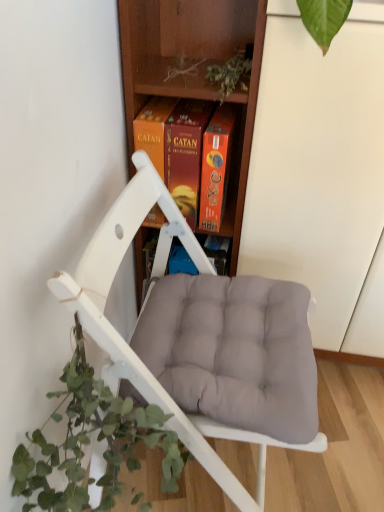
What do you see at coordinates (125, 341) in the screenshot? This screenshot has height=512, width=384. I see `white matte chair at center` at bounding box center [125, 341].

What is the approximate height of white matte chair at center?

It is 31.40 inches.

Locate an element on the screen. orange cardboard game box at center is located at coordinates (176, 146).

Image resolution: width=384 pixels, height=512 pixels. In the image, there is a orange cardboard game box at center. What are the coordinates of `chair below it (from a real-world perspective)` in the screenshot? It's located at click(x=125, y=341).

Does orange cardboard game box at center have a greater height compared to white matte chair at center?

Incorrect, the height of orange cardboard game box at center is not larger of that of white matte chair at center.

From the image's perspective, between orange cardboard game box at center and white matte chair at center, which one is located above?

orange cardboard game box at center appears higher in the image.

Considering the positions of objects orange cardboard game box at center and white matte chair at center in the image provided, who is more to the left, orange cardboard game box at center or white matte chair at center?

orange cardboard game box at center is more to the left.

Does orange cardboard game box at center lie in front of wooden at center?

No, the depth of orange cardboard game box at center is greater than that of wooden at center.

Measure the distance from orange cardboard game box at center to wooden at center.

orange cardboard game box at center is 4.28 inches from wooden at center.

Is orange cardboard game box at center placed right next to wooden at center?

No, orange cardboard game box at center is not beside wooden at center.

Do you think orange cardboard game box at center is within wooden at center, or outside of it?

orange cardboard game box at center lies within the bounds of wooden at center.

Looking at this image, is wooden at center turned away from white matte chair at center?

That's not correct — wooden at center is not looking away from white matte chair at center.

Considering the positions of objects wooden at center and white matte chair at center in the image provided, who is in front, wooden at center or white matte chair at center?

white matte chair at center is more forward.

The height and width of the screenshot is (512, 384). I want to click on shelf behind the white matte chair at center, so click(195, 75).

Choose the correct answer: Is wooden at center inside white matte chair at center or outside it?

wooden at center is not inside white matte chair at center, it's outside.

From their relative heights in the image, would you say wooden at center is taller or shorter than orange cardboard game box at center?

Considering their sizes, wooden at center has more height than orange cardboard game box at center.

Considering the relative sizes of wooden at center and orange cardboard game box at center in the image provided, is wooden at center bigger than orange cardboard game box at center?

Yes, wooden at center is bigger than orange cardboard game box at center.

Can you tell me how much wooden at center and orange cardboard game box at center differ in facing direction?

There is a 1.54-degree angle between the facing directions of wooden at center and orange cardboard game box at center.

Measure the distance from wooden at center to orange cardboard game box at center.

A distance of 4.28 inches exists between wooden at center and orange cardboard game box at center.

Measure the distance between white matte chair at center and orange cardboard game box at center.

The distance of white matte chair at center from orange cardboard game box at center is 23.39 centimeters.

Considering the sizes of objects white matte chair at center and orange cardboard game box at center in the image provided, who is smaller, white matte chair at center or orange cardboard game box at center?

With smaller size is orange cardboard game box at center.

From a real-world perspective, between white matte chair at center and orange cardboard game box at center, who is vertically higher?

orange cardboard game box at center, from a real-world perspective.

Locate an element on the screen. The height and width of the screenshot is (512, 384). book to the left of white matte chair at center is located at coordinates click(x=176, y=146).

Which object is positioned more to the left, wooden at center or green leafy plant at lower left?

Positioned to the left is green leafy plant at lower left.

Does wooden at center have a greater width compared to green leafy plant at lower left?

Correct, the width of wooden at center exceeds that of green leafy plant at lower left.

Identify the location of shelf behind the green leafy plant at lower left. The image size is (384, 512). (195, 75).

Is white matte chair at center placed right next to wooden at center?

No, white matte chair at center is not in contact with wooden at center.

I want to click on chair on the right of wooden at center, so click(125, 341).

Is white matte chair at center behind wooden at center?

No, white matte chair at center is closer to the viewer.

Where is `chair that is on the right side of orange cardboard game box at center`? The height and width of the screenshot is (512, 384). chair that is on the right side of orange cardboard game box at center is located at coordinates tap(125, 341).

This screenshot has width=384, height=512. Identify the location of book below the wooden at center (from the image's perspective). (176, 146).

Based on the photo, based on their spatial positions, is wooden at center or green leafy plant at lower left closer to orange cardboard game box at center?

The object closer to orange cardboard game box at center is wooden at center.

Looking at the image, which one is located further to orange cardboard game box at center, green leafy plant at lower left or white matte chair at center?

The object further to orange cardboard game box at center is green leafy plant at lower left.

Considering their positions, is green leafy plant at lower left positioned further to white matte chair at center than orange cardboard game box at center?

orange cardboard game box at center is positioned further to the anchor white matte chair at center.

Looking at this image, from the image, which object appears to be nearer to wooden at center, green leafy plant at lower left or orange cardboard game box at center?

orange cardboard game box at center is positioned closer to the anchor wooden at center.

From the image, which object appears to be farther from orange cardboard game box at center, green leafy plant at lower left or wooden at center?

Based on the image, green leafy plant at lower left appears to be further to orange cardboard game box at center.

Estimate the real-world distances between objects in this image. Which object is closer to wooden at center, green leafy plant at lower left or white matte chair at center?

Based on the image, white matte chair at center appears to be nearer to wooden at center.

From the image, which object appears to be nearer to white matte chair at center, wooden at center or green leafy plant at lower left?

green leafy plant at lower left is closer to white matte chair at center.

Which object lies nearer to the anchor point green leafy plant at lower left, orange cardboard game box at center or wooden at center?

orange cardboard game box at center lies closer to green leafy plant at lower left than the other object.

Image resolution: width=384 pixels, height=512 pixels. What are the coordinates of `chair that lies between orange cardboard game box at center and green leafy plant at lower left from top to bottom` in the screenshot? It's located at (125, 341).

Image resolution: width=384 pixels, height=512 pixels. Identify the location of chair that lies between wooden at center and green leafy plant at lower left from top to bottom. (125, 341).

This screenshot has width=384, height=512. I want to click on book between wooden at center and white matte chair at center in the vertical direction, so click(176, 146).

This screenshot has height=512, width=384. I want to click on book between wooden at center and green leafy plant at lower left in the vertical direction, so click(176, 146).